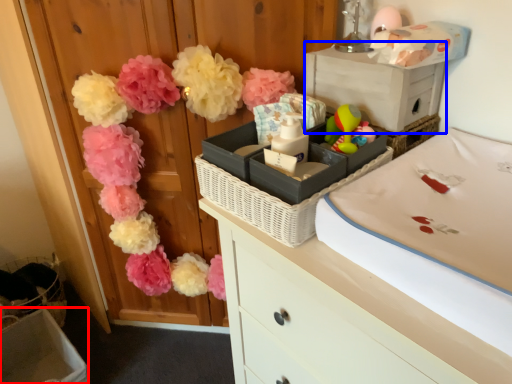
Question: Among these objects, which one is nearest to the camera, storage box (highlighted by a red box) or storage box (highlighted by a blue box)?

Choices:
 (A) storage box
 (B) storage box

Answer: (B)